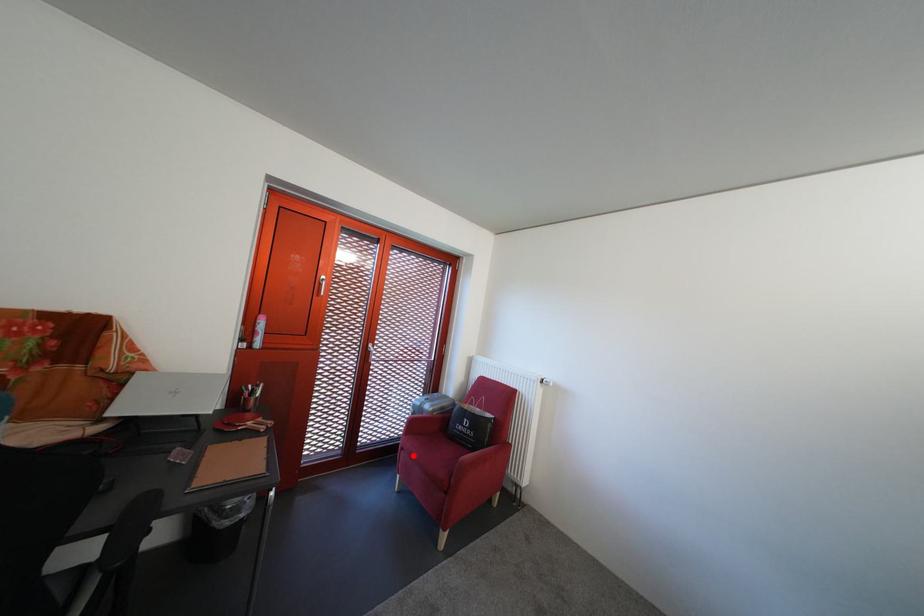
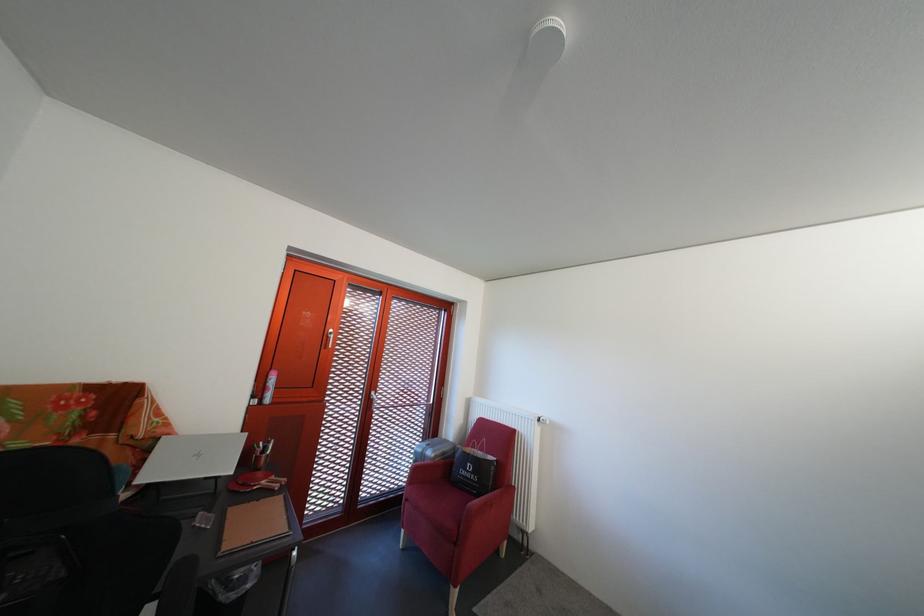
Where in the second image is the point corresponding to the highlighted location from the first image?

(418, 507)